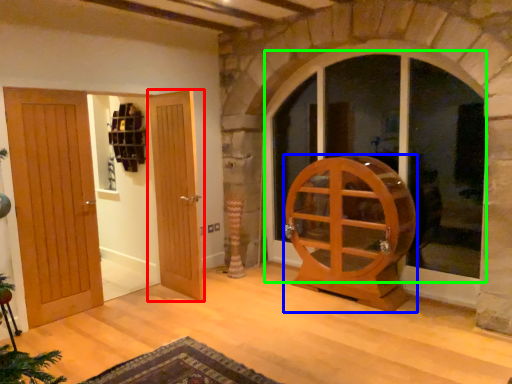
Question: Which object is the farthest from door (highlighted by a red box)? Choose among these: furniture (highlighted by a blue box) or window (highlighted by a green box).

Choices:
 (A) furniture
 (B) window

Answer: (B)